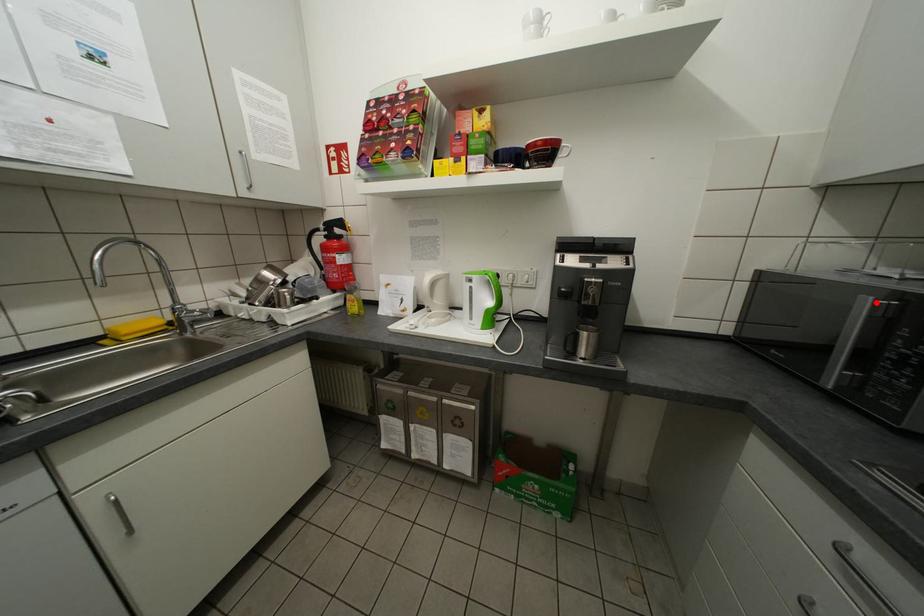
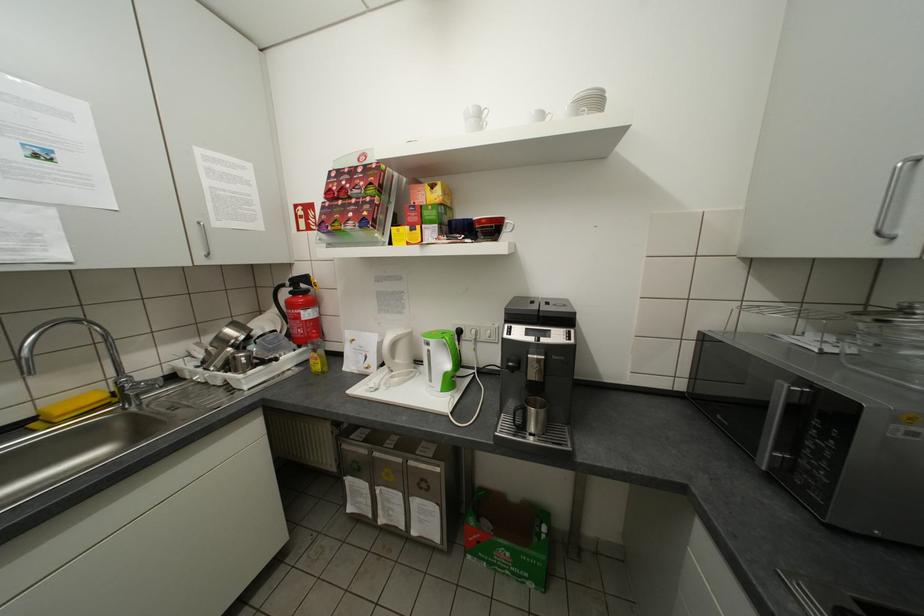
In the second image, find the point that corresponds to the highlighted location in the first image.

(793, 389)